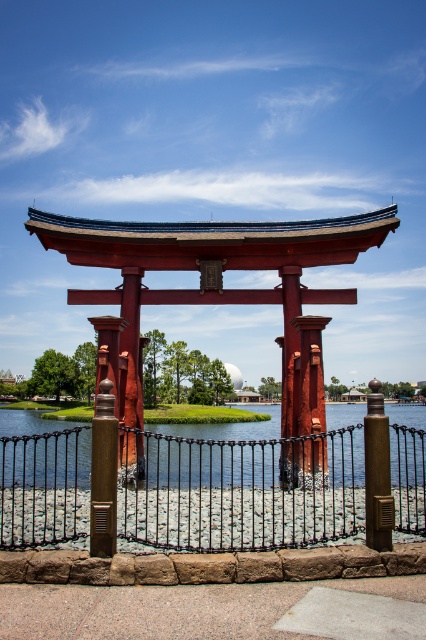
You are a visitor approaching the torii gate. You notice the black wrought iron fence at center and the clear water at gate center. Which one do you think is shorter in height?

The black wrought iron fence at center is not as tall as the clear water at gate center, so the fence is shorter in height.